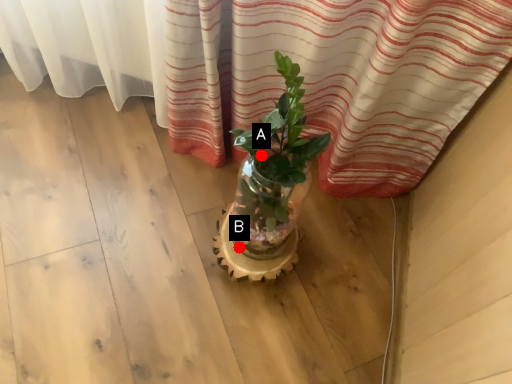
Question: Two points are circled on the image, labeled by A and B beside each circle. Which of the following is the closest to the observer?

Choices:
 (A) A is closer
 (B) B is closer

Answer: (A)